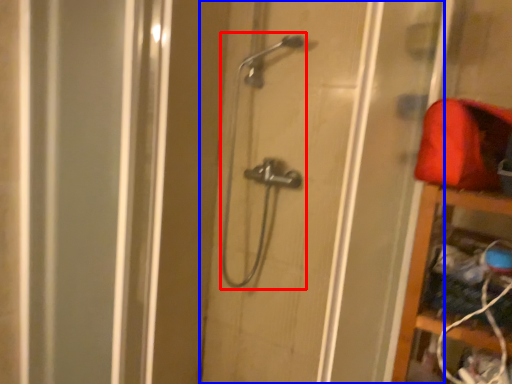
Question: Which object appears farthest to the camera in this image, shower (highlighted by a red box) or door (highlighted by a blue box)?

Choices:
 (A) shower
 (B) door

Answer: (A)